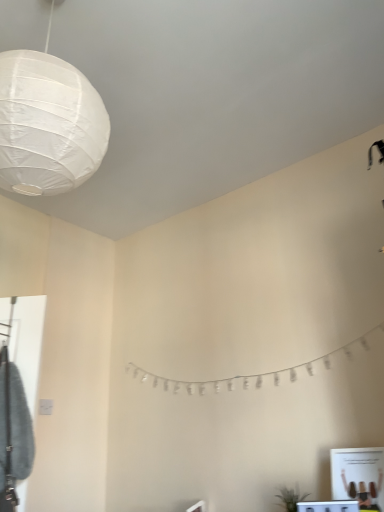
Question: Is white glossy vanity at lower right placed right next to green matte plant at lower right?

Choices:
 (A) no
 (B) yes

Answer: (A)

Question: Can you confirm if white glossy vanity at lower right is smaller than green matte plant at lower right?

Choices:
 (A) yes
 (B) no

Answer: (B)

Question: Does white glossy vanity at lower right have a lesser width compared to green matte plant at lower right?

Choices:
 (A) no
 (B) yes

Answer: (B)

Question: Does white glossy vanity at lower right have a greater height compared to green matte plant at lower right?

Choices:
 (A) yes
 (B) no

Answer: (B)

Question: Does white glossy vanity at lower right appear on the right side of green matte plant at lower right?

Choices:
 (A) yes
 (B) no

Answer: (A)

Question: Is white glossy vanity at lower right wider than green matte plant at lower right?

Choices:
 (A) yes
 (B) no

Answer: (B)

Question: Considering the relative sizes of white paper lantern at upper left and white glossy vanity at lower right in the image provided, is white paper lantern at upper left thinner than white glossy vanity at lower right?

Choices:
 (A) yes
 (B) no

Answer: (B)

Question: Is white paper lantern at upper left to the right of white glossy vanity at lower right from the viewer's perspective?

Choices:
 (A) yes
 (B) no

Answer: (B)

Question: Is white glossy vanity at lower right a part of white paper lantern at upper left?

Choices:
 (A) no
 (B) yes

Answer: (A)

Question: From the image's perspective, would you say white paper lantern at upper left is positioned over white glossy vanity at lower right?

Choices:
 (A) yes
 (B) no

Answer: (A)

Question: Is white paper lantern at upper left not within white glossy vanity at lower right?

Choices:
 (A) no
 (B) yes

Answer: (B)

Question: Does white paper lantern at upper left have a larger size compared to white glossy vanity at lower right?

Choices:
 (A) yes
 (B) no

Answer: (A)

Question: Is white glossy vanity at lower right to the right of white paper garland at center from the viewer's perspective?

Choices:
 (A) yes
 (B) no

Answer: (A)